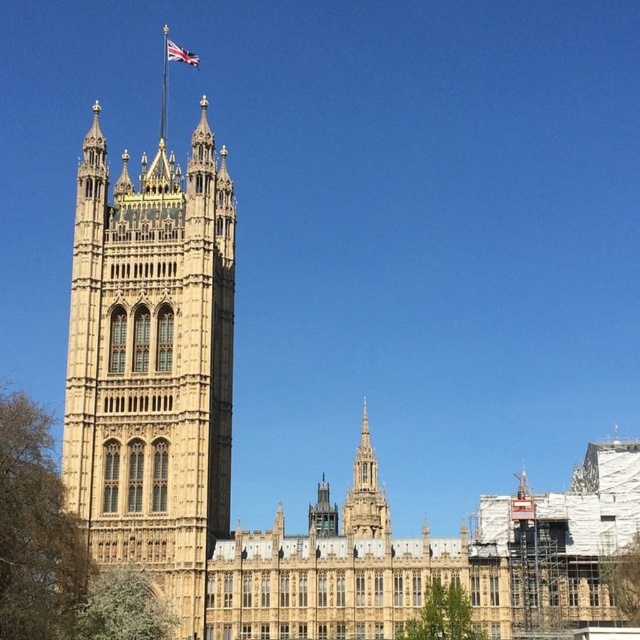
You are standing in front of the Palace of Westminster and want to take a photo. You notice two points on the building labeled as point (90, 296) and point (356, 493). Which point appears closer to you in the image?

Point (90, 296) is closer to the camera than point (356, 493).

You are a tourist standing in front of the Palace of Westminster. You notice the golden stone spire at center and the union jack fabric at top center. Which object is taller?

The golden stone spire at center is much taller than the union jack fabric at top center.